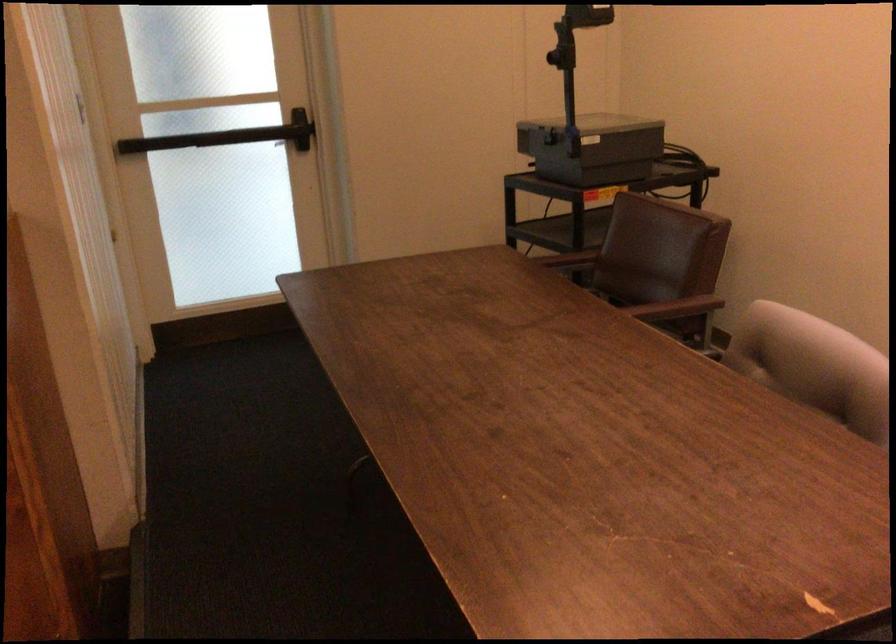
What are the coordinates of `black door push bar` in the screenshot? It's located at (207, 138).